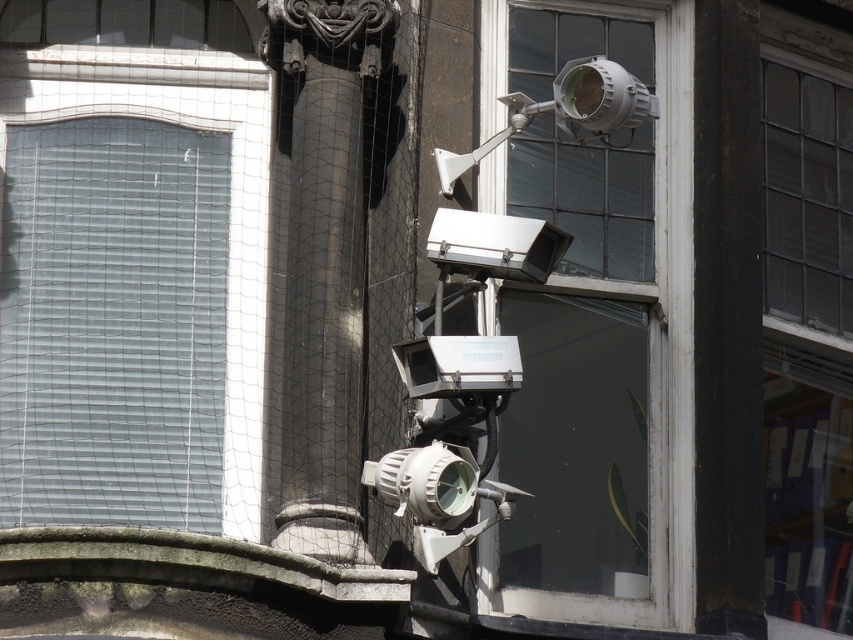
Is clear glass window at center taller than white plastic video camera at center?

Indeed, clear glass window at center has a greater height compared to white plastic video camera at center.

What do you see at coordinates (595, 326) in the screenshot? I see `clear glass window at center` at bounding box center [595, 326].

Where is `clear glass window at center`? clear glass window at center is located at coordinates (595, 326).

Which is more to the right, clear glass window at center or matte white security camera at upper center?

From the viewer's perspective, clear glass window at center appears more on the right side.

Identify the location of clear glass window at center. The image size is (853, 640). (595, 326).

At what (x,y) coordinates should I click in order to perform the action: click on clear glass window at center. Please return your answer as a coordinate pair (x, y). The height and width of the screenshot is (640, 853). Looking at the image, I should click on (595, 326).

Is point (409, 376) closer to camera compared to point (595, 68)?

That is True.

Who is more distant from viewer, (482, 524) or (453, 164)?

Point (453, 164)

Where is `white plastic video camera at center`? Image resolution: width=853 pixels, height=640 pixels. white plastic video camera at center is located at coordinates (462, 380).